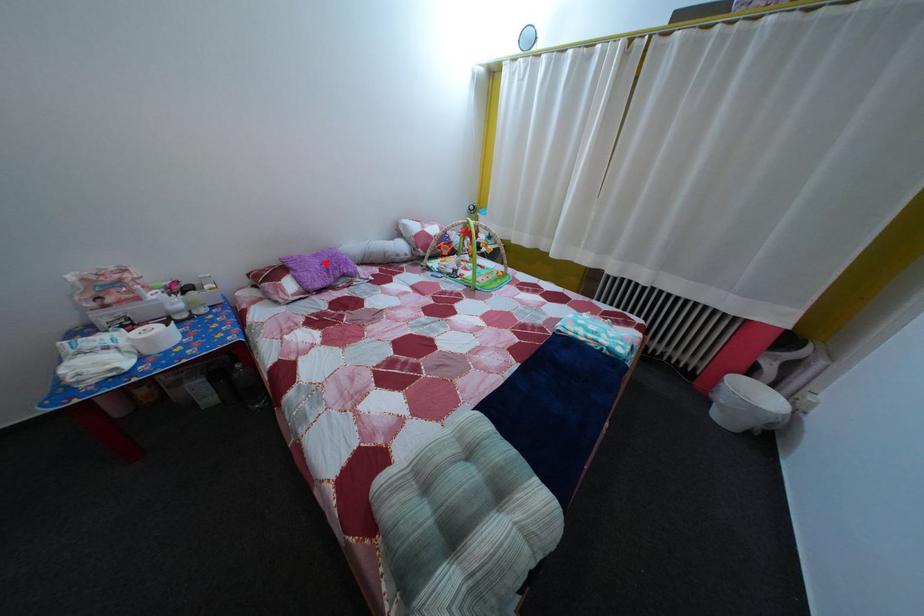
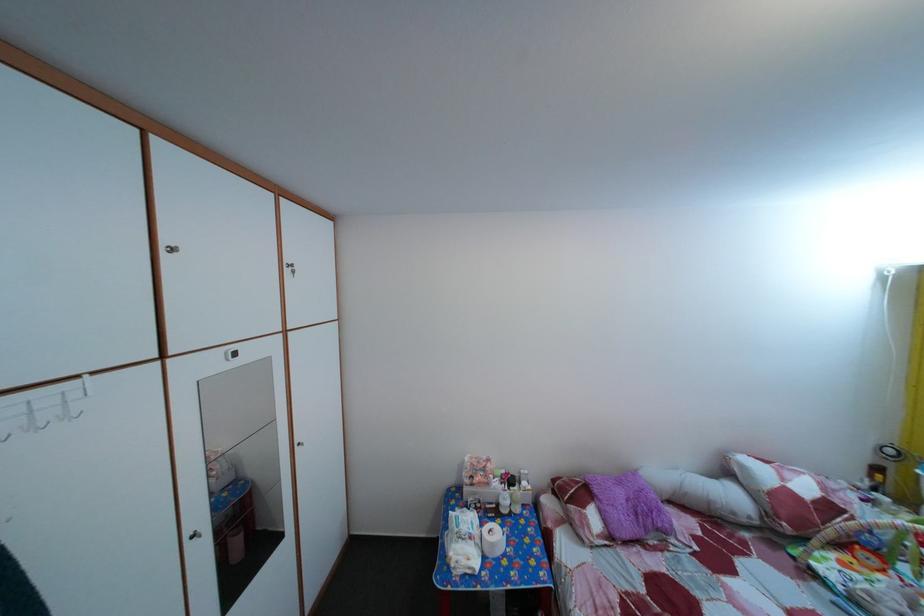
Question: I am providing you with two images of the same scene from different viewpoints. In image1, a red point is highlighted. Considering the same 3D point in image2, which of the following is correct?

Choices:
 (A) It is closer
 (B) It is farther

Answer: (B)